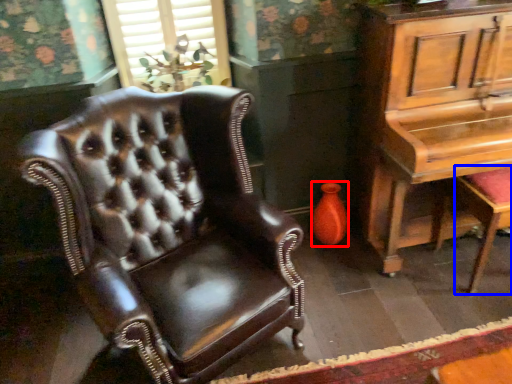
Question: Which object is further to the camera taking this photo, vase (highlighted by a red box) or music stool (highlighted by a blue box)?

Choices:
 (A) vase
 (B) music stool

Answer: (A)